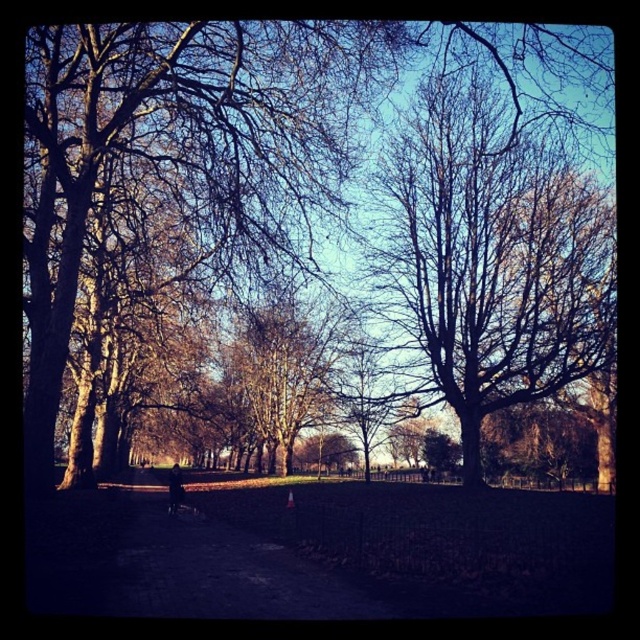
You are a bird looking for a place to perch. You see the brown leafless tree at center and the dark asphalt path at center. Which one is taller?

The brown leafless tree at center is much taller than the dark asphalt path at center, so the tree is the taller option for perching.

You are planning to take a photo of the dark asphalt path at center and want to include the bare wood tree at center in the background for depth. Given their sizes, will the tree appear larger or smaller in the photo compared to the path?

The bare wood tree at center has a larger size compared to the dark asphalt path at center, so in the photo, the tree will appear larger than the path.